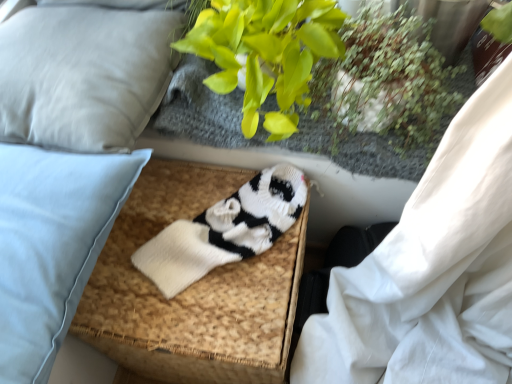
Question: Considering the relative sizes of light blue fabric pillow at left, which is counted as the 2th pillow, starting from the top, and light gray fabric pillow at upper left, acting as the 1th pillow starting from the top, in the image provided, is light blue fabric pillow at left, which is counted as the 2th pillow, starting from the top, shorter than light gray fabric pillow at upper left, acting as the 1th pillow starting from the top,?

Choices:
 (A) yes
 (B) no

Answer: (B)

Question: From the image's perspective, does light blue fabric pillow at left, which is counted as the 2th pillow, starting from the top, appear higher than light gray fabric pillow at upper left, acting as the 1th pillow starting from the top?

Choices:
 (A) yes
 (B) no

Answer: (B)

Question: Is light blue fabric pillow at left, positioned as the 1th pillow in bottom-to-top order, directly adjacent to light gray fabric pillow at upper left, the second pillow from the bottom?

Choices:
 (A) yes
 (B) no

Answer: (B)

Question: From the image's perspective, is light blue fabric pillow at left, positioned as the 1th pillow in bottom-to-top order, under light gray fabric pillow at upper left, the second pillow from the bottom?

Choices:
 (A) no
 (B) yes

Answer: (B)

Question: Is light blue fabric pillow at left, which is counted as the 2th pillow, starting from the top, turned away from light gray fabric pillow at upper left, the second pillow from the bottom?

Choices:
 (A) yes
 (B) no

Answer: (B)

Question: Is light blue fabric pillow at left, positioned as the 1th pillow in bottom-to-top order, at the left side of light gray fabric pillow at upper left, the second pillow from the bottom?

Choices:
 (A) no
 (B) yes

Answer: (A)

Question: Is light gray fabric pillow at upper left, acting as the 1th pillow starting from the top, not near green leafy plant at upper right?

Choices:
 (A) no
 (B) yes

Answer: (A)

Question: Does light gray fabric pillow at upper left, acting as the 1th pillow starting from the top, turn towards green leafy plant at upper right?

Choices:
 (A) yes
 (B) no

Answer: (A)

Question: Does light gray fabric pillow at upper left, the second pillow from the bottom, lie behind green leafy plant at upper right?

Choices:
 (A) no
 (B) yes

Answer: (B)

Question: Could green leafy plant at upper right be considered to be inside light gray fabric pillow at upper left, acting as the 1th pillow starting from the top?

Choices:
 (A) no
 (B) yes

Answer: (A)

Question: Is light gray fabric pillow at upper left, acting as the 1th pillow starting from the top, outside of green leafy plant at upper right?

Choices:
 (A) yes
 (B) no

Answer: (A)

Question: Considering the relative sizes of light gray fabric pillow at upper left, the second pillow from the bottom, and green leafy plant at upper right in the image provided, is light gray fabric pillow at upper left, the second pillow from the bottom, taller than green leafy plant at upper right?

Choices:
 (A) no
 (B) yes

Answer: (A)

Question: Could you tell me if light gray fabric pillow at upper left, acting as the 1th pillow starting from the top, is facing white knitted footrest at center?

Choices:
 (A) yes
 (B) no

Answer: (B)